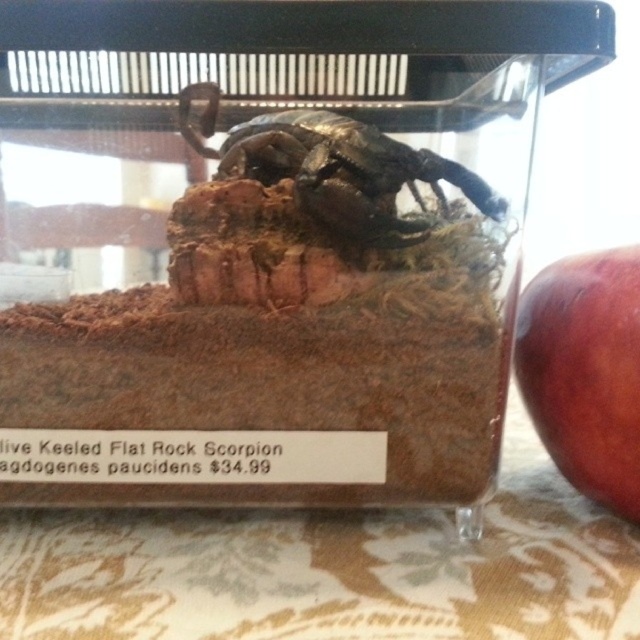
Question: Which point is closer to the camera?

Choices:
 (A) red matte apple at right
 (B) metallic scorpion at center

Answer: (B)

Question: Among these points, which one is farthest from the camera?

Choices:
 (A) (291, 115)
 (B) (605, 352)

Answer: (A)

Question: Can you confirm if red matte apple at right is positioned to the left of metallic scorpion at center?

Choices:
 (A) yes
 (B) no

Answer: (B)

Question: Is red matte apple at right smaller than metallic scorpion at center?

Choices:
 (A) no
 (B) yes

Answer: (B)

Question: Does red matte apple at right appear under metallic scorpion at center?

Choices:
 (A) no
 (B) yes

Answer: (B)